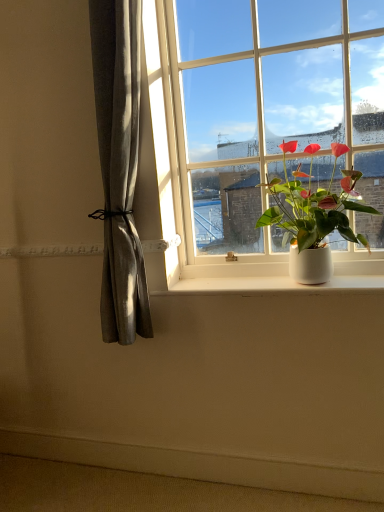
Question: Is the position of white glossy window at upper center more distant than that of green matte plant at right?

Choices:
 (A) yes
 (B) no

Answer: (A)

Question: Is white glossy window at upper center smaller than green matte plant at right?

Choices:
 (A) yes
 (B) no

Answer: (B)

Question: Is white glossy window at upper center wider than green matte plant at right?

Choices:
 (A) yes
 (B) no

Answer: (B)

Question: From the image's perspective, is white glossy window at upper center over green matte plant at right?

Choices:
 (A) no
 (B) yes

Answer: (B)

Question: Is green matte plant at right completely or partially inside white glossy window at upper center?

Choices:
 (A) no
 (B) yes

Answer: (A)

Question: Considering the positions of green matte plant at right and white smooth ledge at lower center in the image, is green matte plant at right taller or shorter than white smooth ledge at lower center?

Choices:
 (A) tall
 (B) short

Answer: (A)

Question: From the image's perspective, is green matte plant at right positioned above or below white smooth ledge at lower center?

Choices:
 (A) below
 (B) above

Answer: (B)

Question: Would you say green matte plant at right is to the left or to the right of white smooth ledge at lower center in the picture?

Choices:
 (A) right
 (B) left

Answer: (A)

Question: Is green matte plant at right bigger or smaller than white smooth ledge at lower center?

Choices:
 (A) small
 (B) big

Answer: (B)

Question: Considering the positions of white glossy window at upper center and white smooth window sill at lower center in the image, is white glossy window at upper center bigger or smaller than white smooth window sill at lower center?

Choices:
 (A) big
 (B) small

Answer: (A)

Question: Is point (311, 138) closer or farther from the camera than point (311, 287)?

Choices:
 (A) closer
 (B) farther

Answer: (B)

Question: From a real-world perspective, relative to white smooth window sill at lower center, is white glossy window at upper center vertically above or below?

Choices:
 (A) below
 (B) above

Answer: (B)

Question: Is white glossy window at upper center wider or thinner than white smooth window sill at lower center?

Choices:
 (A) thin
 (B) wide

Answer: (B)

Question: Based on their sizes in the image, would you say white smooth window sill at lower center is bigger or smaller than white glossy window at upper center?

Choices:
 (A) big
 (B) small

Answer: (B)

Question: From the image's perspective, is white smooth window sill at lower center positioned above or below white glossy window at upper center?

Choices:
 (A) above
 (B) below

Answer: (B)